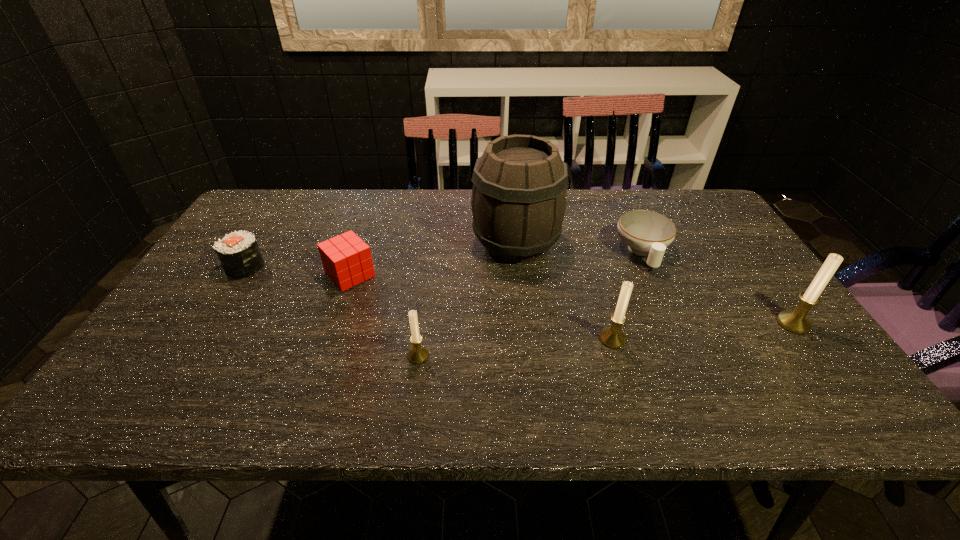
What are the coordinates of `free space between the fifth shortest object and the fourth object from right to left` in the screenshot? It's located at (564, 292).

You are a GUI agent. You are given a task and a screenshot of the screen. Output one action in this format:
    pyautogui.click(x=<x>, y=<y>)
    Task: Click on the free spot between the leftmost object and the tallest candle holder
    The height and width of the screenshot is (540, 960).
    Given the screenshot: What is the action you would take?
    pyautogui.click(x=519, y=295)

Locate an element on the screen. The height and width of the screenshot is (540, 960). vacant area that lies between the rightmost object and the leftmost object is located at coordinates (519, 295).

Image resolution: width=960 pixels, height=540 pixels. Identify the location of free area in between the tallest object and the shortest candle holder. [x=468, y=300].

You are a GUI agent. You are given a task and a screenshot of the screen. Output one action in this format:
    pyautogui.click(x=<x>, y=<y>)
    Task: Click on the vacant area between the chinaware and the fourth object from right to left
    The height and width of the screenshot is (540, 960).
    Given the screenshot: What is the action you would take?
    pos(579,248)

Image resolution: width=960 pixels, height=540 pixels. I want to click on the sixth closest object relative to the rightmost candle holder, so click(x=238, y=252).

Find the location of a particular element. This screenshot has height=540, width=960. object that is the fourth closest one to the second object from left to right is located at coordinates (612, 337).

Identify which candle holder is the nearest to the cube. Please provide its 2D coordinates. Your answer should be formatted as a tuple, i.e. [(x, y)], where the tuple contains the x and y coordinates of a point satisfying the conditions above.

[(418, 354)]

Identify which candle holder is the second closest to the tallest candle holder. Please provide its 2D coordinates. Your answer should be formatted as a tuple, i.e. [(x, y)], where the tuple contains the x and y coordinates of a point satisfying the conditions above.

[(418, 354)]

Identify the location of free space in the image that satisfies the following two spatial constraints: 1. on the back side of the rightmost object; 2. on the left side of the third object from right to left. This screenshot has width=960, height=540. pos(608,323).